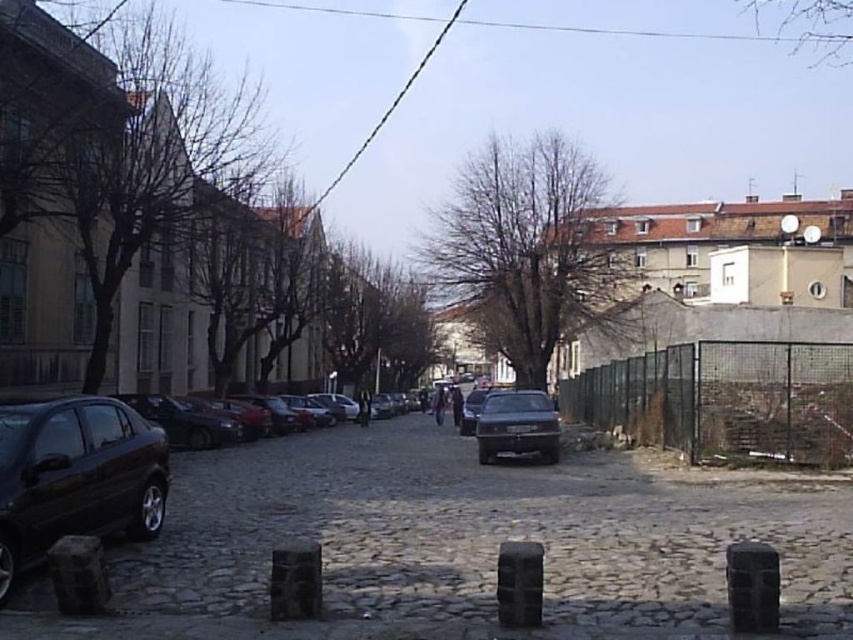
Can you confirm if matte black sedan at lower left is positioned to the left of shiny black car at center?

Correct, you'll find matte black sedan at lower left to the left of shiny black car at center.

Measure the distance between matte black sedan at lower left and camera.

matte black sedan at lower left is 7.29 meters from camera.

Who is more forward, (79, 458) or (483, 445)?

Point (79, 458) is more forward.

Image resolution: width=853 pixels, height=640 pixels. What are the coordinates of `matte black sedan at lower left` in the screenshot? It's located at (74, 476).

Which of these two, green wire mesh fence at right or shiny black car at center, stands shorter?

shiny black car at center is shorter.

Based on the photo, does green wire mesh fence at right have a lesser width compared to shiny black car at center?

In fact, green wire mesh fence at right might be wider than shiny black car at center.

Identify the location of green wire mesh fence at right. This screenshot has width=853, height=640. (724, 401).

The height and width of the screenshot is (640, 853). What are the coordinates of `green wire mesh fence at right` in the screenshot? It's located at (724, 401).

Can you confirm if dark gray cobblestone alley at center is positioned above green wire mesh fence at right?

No.

Is point (267, 454) closer to camera compared to point (801, 449)?

No, (267, 454) is behind (801, 449).

Which is behind, point (244, 531) or point (750, 449)?

Positioned behind is point (750, 449).

This screenshot has height=640, width=853. I want to click on dark gray cobblestone alley at center, so click(454, 545).